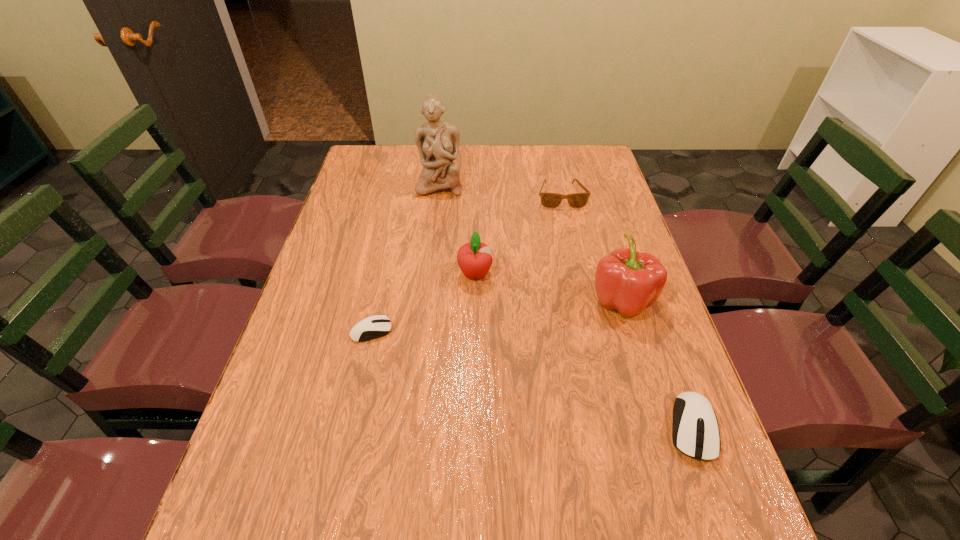
Locate an element on the screen. The image size is (960, 540). the shortest object is located at coordinates (375, 326).

Locate an element on the screen. The height and width of the screenshot is (540, 960). the left mouse is located at coordinates (375, 326).

Where is `the nearest object`? The height and width of the screenshot is (540, 960). the nearest object is located at coordinates (695, 432).

Locate an element on the screen. The image size is (960, 540). the right mouse is located at coordinates (695, 432).

Identify the location of sunglasses. (549, 200).

This screenshot has height=540, width=960. I want to click on the tallest object, so click(438, 142).

Locate an element on the screen. This screenshot has width=960, height=540. the fourth object from right to left is located at coordinates (474, 259).

You are a GUI agent. You are given a task and a screenshot of the screen. Output one action in this format:
    pyautogui.click(x=<x>, y=<y>)
    Task: Click on the apple
    The height and width of the screenshot is (540, 960).
    Given the screenshot: What is the action you would take?
    pyautogui.click(x=474, y=259)

Where is `pepper`? Image resolution: width=960 pixels, height=540 pixels. pepper is located at coordinates (626, 280).

Identify the location of free space located 0.050m on the front of the left mouse. (365, 361).